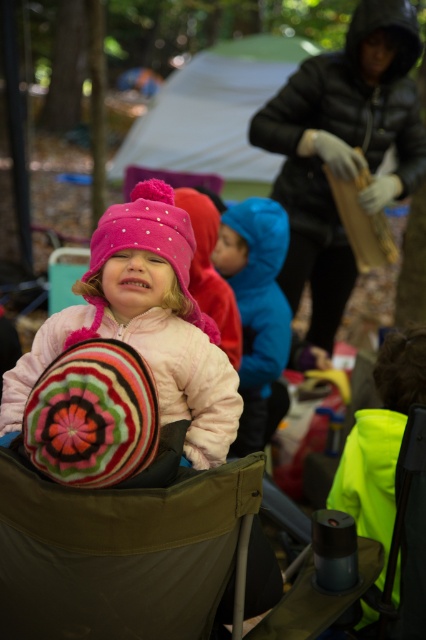
You are planning to set up a tent in this camping scene. You have a green fabric folding chair at center and a white fabric tent at upper center. Which object is shorter in height?

The green fabric folding chair at center is shorter in height compared to the white fabric tent at upper center.